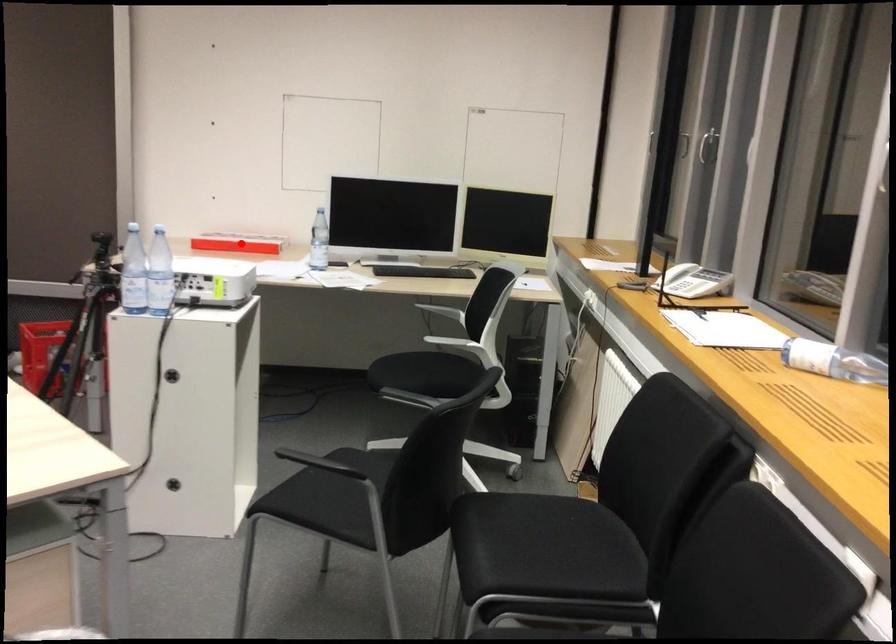
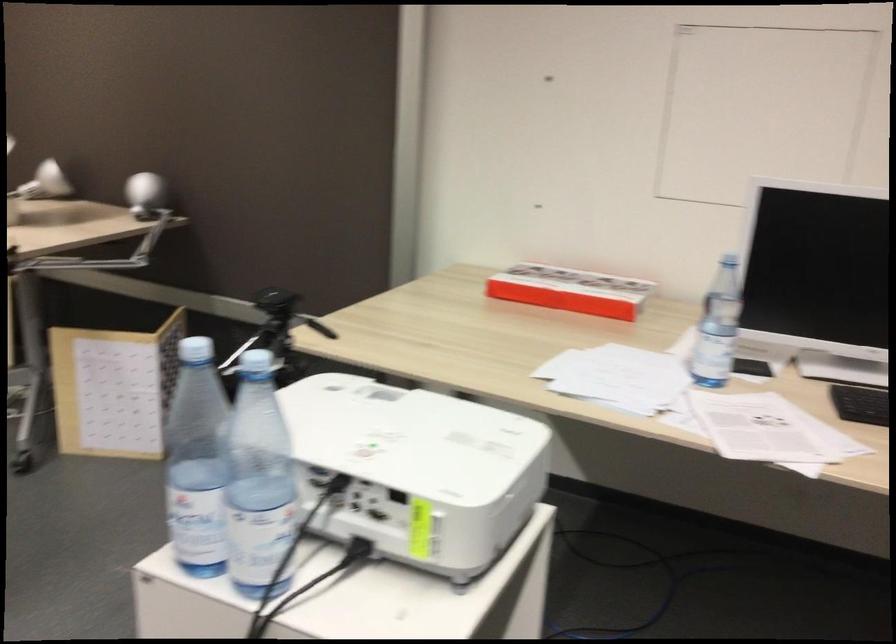
The point at the highlighted location is marked in the first image. Where is the corresponding point in the second image?

(570, 290)